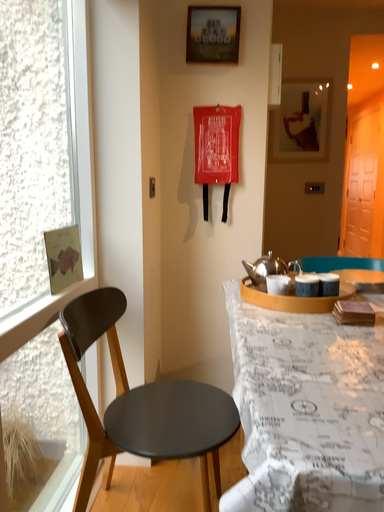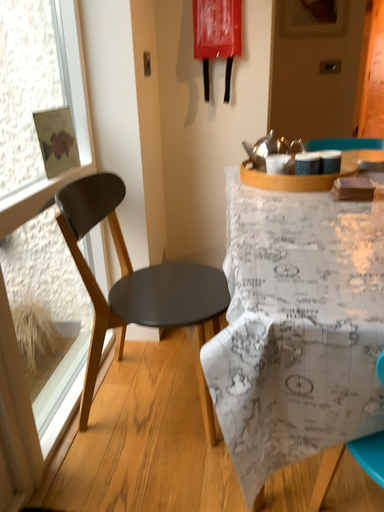
Question: Which way did the camera rotate in the video?

Choices:
 (A) rotated upward
 (B) rotated downward

Answer: (B)